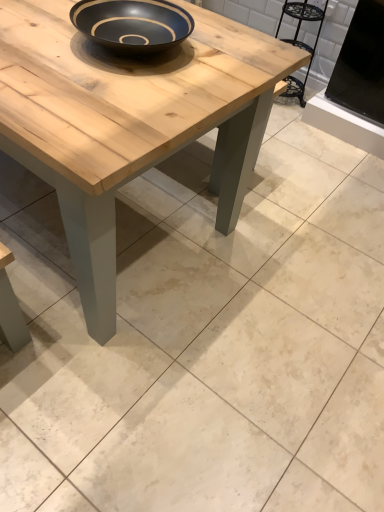
Question: Is metallic black chair at upper right turned away from natural wood coffee table at center?

Choices:
 (A) no
 (B) yes

Answer: (A)

Question: Would you say natural wood coffee table at center is part of metallic black chair at upper right's contents?

Choices:
 (A) yes
 (B) no

Answer: (B)

Question: Is metallic black chair at upper right wider than natural wood coffee table at center?

Choices:
 (A) yes
 (B) no

Answer: (B)

Question: Is metallic black chair at upper right with natural wood coffee table at center?

Choices:
 (A) yes
 (B) no

Answer: (B)

Question: From the image's perspective, is metallic black chair at upper right above natural wood coffee table at center?

Choices:
 (A) yes
 (B) no

Answer: (A)

Question: Is metallic black chair at upper right positioned far away from natural wood coffee table at center?

Choices:
 (A) yes
 (B) no

Answer: (A)

Question: Would you say natural wood coffee table at center is outside metallic black chair at upper right?

Choices:
 (A) yes
 (B) no

Answer: (A)

Question: Can you confirm if natural wood coffee table at center is smaller than metallic black chair at upper right?

Choices:
 (A) yes
 (B) no

Answer: (B)

Question: Can you confirm if natural wood coffee table at center is positioned to the right of metallic black chair at upper right?

Choices:
 (A) yes
 (B) no

Answer: (B)

Question: From the image's perspective, is natural wood coffee table at center located above metallic black chair at upper right?

Choices:
 (A) yes
 (B) no

Answer: (B)

Question: Can you confirm if natural wood coffee table at center is taller than metallic black chair at upper right?

Choices:
 (A) yes
 (B) no

Answer: (A)

Question: Is metallic black chair at upper right at the back of natural wood coffee table at center?

Choices:
 (A) no
 (B) yes

Answer: (A)

Question: Is natural wood coffee table at center in front of or behind metallic black chair at upper right in the image?

Choices:
 (A) behind
 (B) front

Answer: (B)